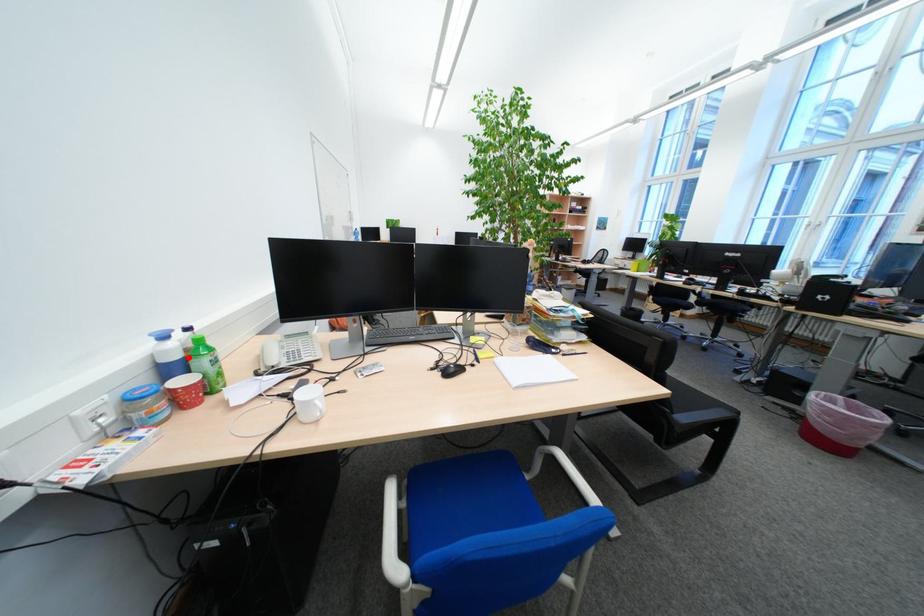
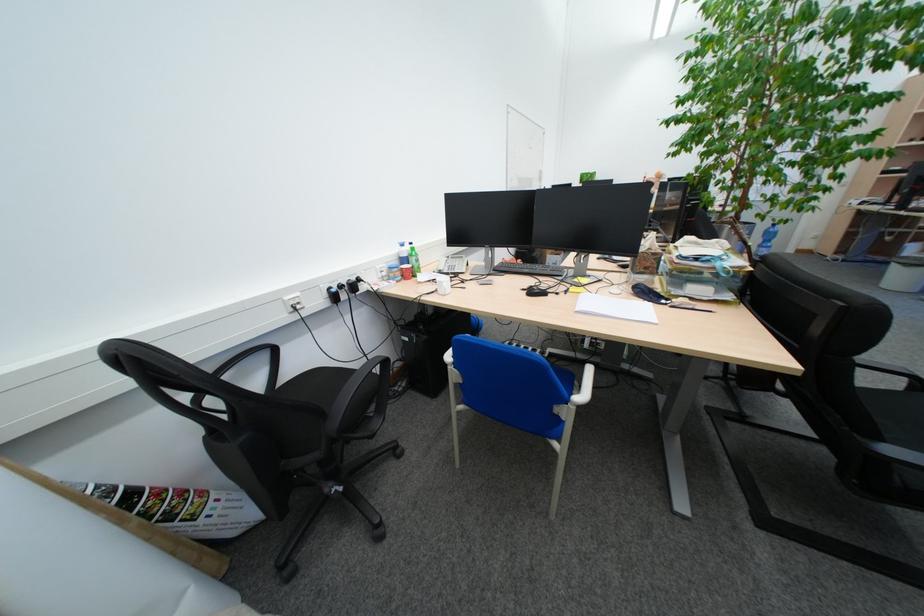
Where in the second image is the point corresponding to the highlighted location from the first image?

(417, 256)